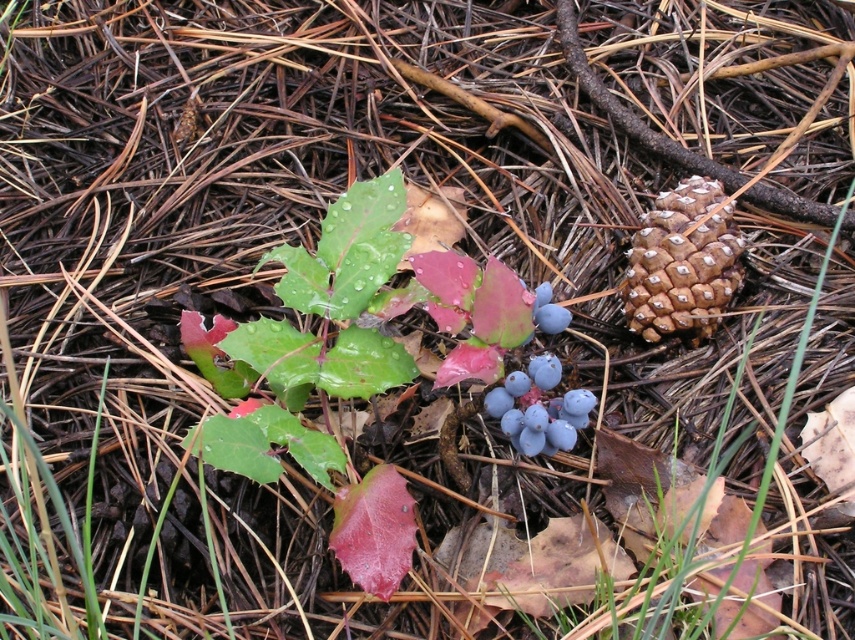
Question: Which of the following is the closest to the observer?

Choices:
 (A) (540, 378)
 (B) (631, 298)

Answer: (A)

Question: Does brown rough pine cone at right appear under blue matte berries at center?

Choices:
 (A) no
 (B) yes

Answer: (A)

Question: Which point appears closest to the camera in this image?

Choices:
 (A) (643, 228)
 (B) (544, 433)

Answer: (B)

Question: Which point is closer to the camera taking this photo?

Choices:
 (A) click(677, 321)
 (B) click(513, 440)

Answer: (B)

Question: Can you confirm if brown rough pine cone at right is positioned above blue matte berries at center?

Choices:
 (A) no
 (B) yes

Answer: (B)

Question: Does brown rough pine cone at right have a larger size compared to blue matte berries at center?

Choices:
 (A) yes
 (B) no

Answer: (A)